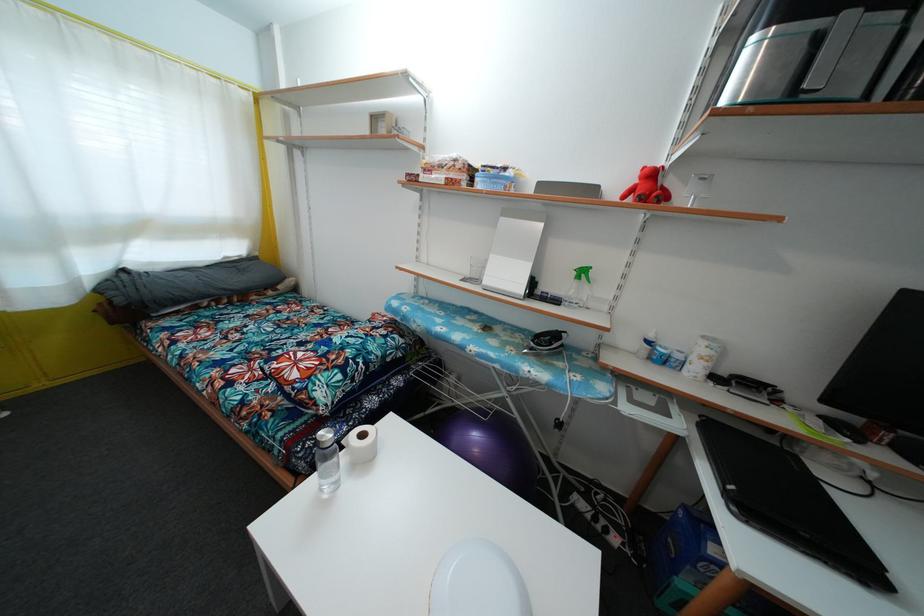
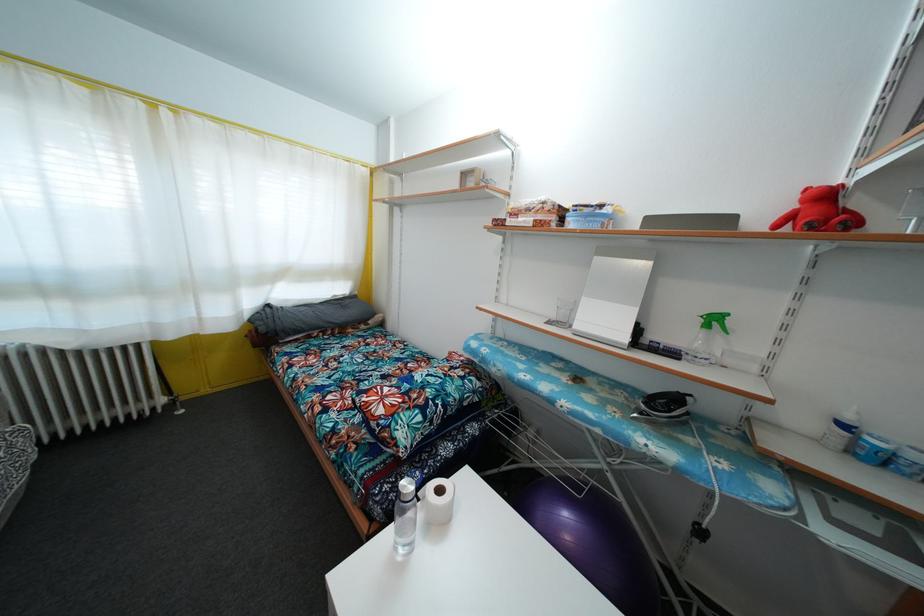
The point at [480,458] is marked in the first image. Where is the corresponding point in the second image?

(572, 545)